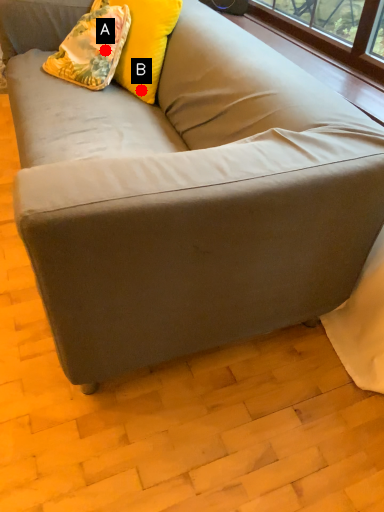
Question: Two points are circled on the image, labeled by A and B beside each circle. Among these points, which one is nearest to the camera?

Choices:
 (A) A is closer
 (B) B is closer

Answer: (A)